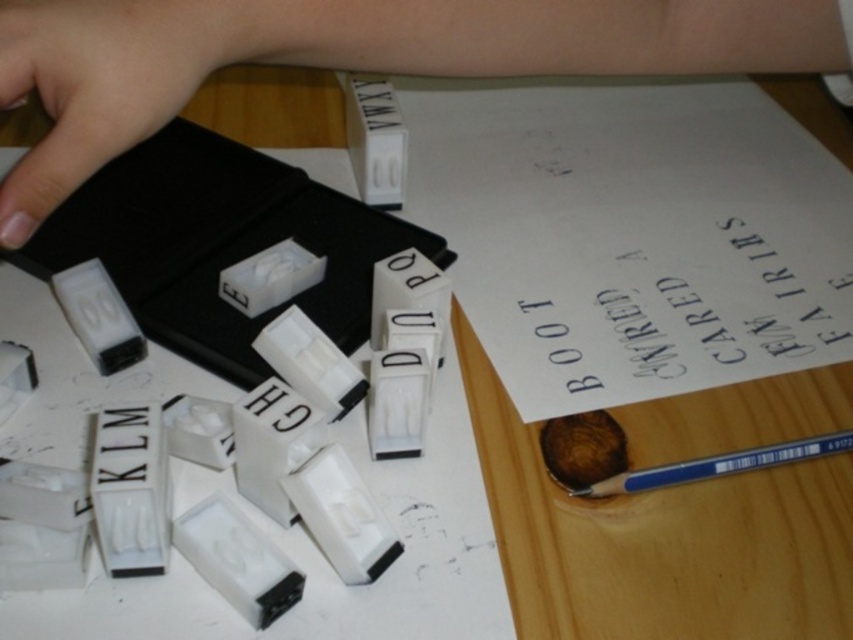
You are looking at the wooden table with letter blocks and a black rectangular object. There are two points marked on the table surface at coordinates point (834, 68) and point (32, 26). Which point is closer to you?

Point (834, 68) is further to the camera than point (32, 26), so the closer point to you is point (32, 26).

You are holding a small toy that is 12 inches long. You want to place it on the table so that it starts at point [172,84] and extends towards you. Will the toy fit entirely on the table without hanging off the edge?

The distance between point [172,84] and the viewer is 15.92 inches. Since the toy is only 12 inches long, placing it from that point towards you would leave enough space, so yes, it will fit entirely on the table.

You are trying to place the pale skin at upper left and the blue plastic pencil at lower right into a box that can only fit items narrower than the pencil. Which item cannot fit into the box?

The pale skin at upper left cannot fit into the box because its width surpasses that of the blue plastic pencil at lower right.